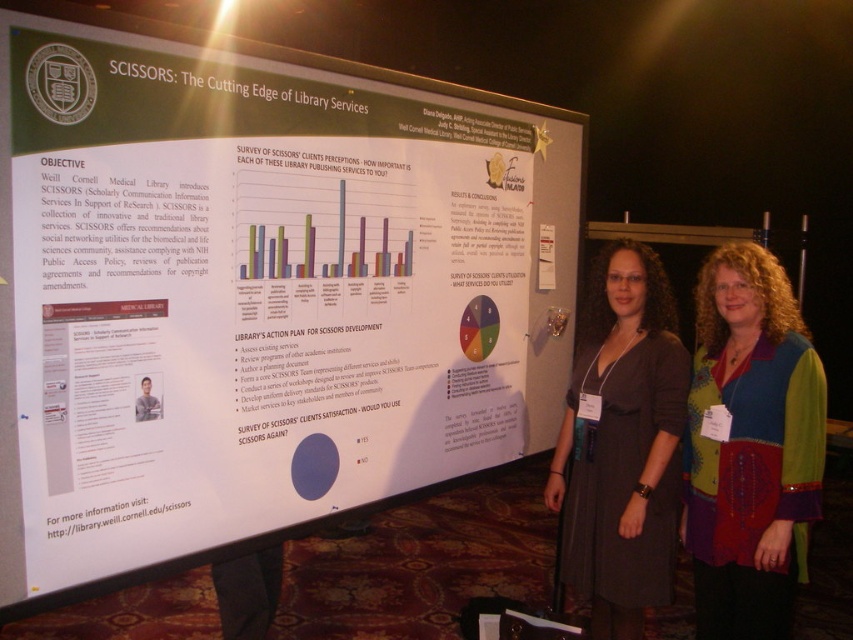
Can you confirm if white paperboard at center is wider than matte gray dress at center?

Indeed, white paperboard at center has a greater width compared to matte gray dress at center.

Image resolution: width=853 pixels, height=640 pixels. What are the coordinates of `white paperboard at center` in the screenshot? It's located at (257, 289).

Can you confirm if multicolored patchwork blouse at center is shorter than matte gray dress at center?

Yes, multicolored patchwork blouse at center is shorter than matte gray dress at center.

Is multicolored patchwork blouse at center to the right of matte gray dress at center from the viewer's perspective?

Indeed, multicolored patchwork blouse at center is positioned on the right side of matte gray dress at center.

Locate an element on the screen. This screenshot has height=640, width=853. multicolored patchwork blouse at center is located at coordinates (750, 445).

Locate an element on the screen. The width and height of the screenshot is (853, 640). multicolored patchwork blouse at center is located at coordinates (750, 445).

Between point (166, 102) and point (793, 460), which one is positioned in front?

Point (166, 102) is in front.

Does white paperboard at center have a smaller size compared to multicolored patchwork blouse at center?

Incorrect, white paperboard at center is not smaller in size than multicolored patchwork blouse at center.

Which is behind, point (55, 554) or point (764, 280)?

Point (764, 280)

You are a GUI agent. You are given a task and a screenshot of the screen. Output one action in this format:
    pyautogui.click(x=<x>, y=<y>)
    Task: Click on the white paperboard at center
    The width and height of the screenshot is (853, 640).
    Given the screenshot: What is the action you would take?
    pyautogui.click(x=257, y=289)